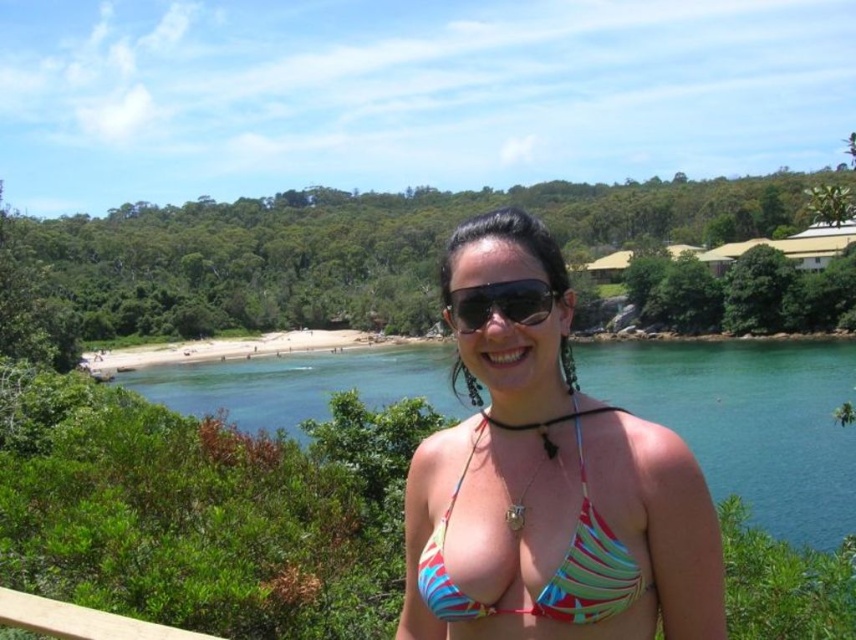
Question: Among these objects, which one is farthest from the camera?

Choices:
 (A) multicolored fabric bikini top at center
 (B) blue water at center
 (C) multicolored fabric bikini at center
 (D) black plastic sunglasses at center

Answer: (B)

Question: Does multicolored fabric bikini at center have a larger size compared to multicolored fabric bikini top at center?

Choices:
 (A) no
 (B) yes

Answer: (B)

Question: Is multicolored fabric bikini top at center to the right of black plastic sunglasses at center from the viewer's perspective?

Choices:
 (A) yes
 (B) no

Answer: (A)

Question: Which point is closer to the camera taking this photo?

Choices:
 (A) click(x=541, y=288)
 (B) click(x=428, y=580)
 (C) click(x=702, y=422)
 (D) click(x=542, y=272)

Answer: (A)

Question: Which of these objects is positioned closest to the multicolored fabric bikini at center?

Choices:
 (A) blue water at center
 (B) multicolored fabric bikini top at center

Answer: (B)

Question: Is multicolored fabric bikini top at center in front of black plastic sunglasses at center?

Choices:
 (A) yes
 (B) no

Answer: (A)